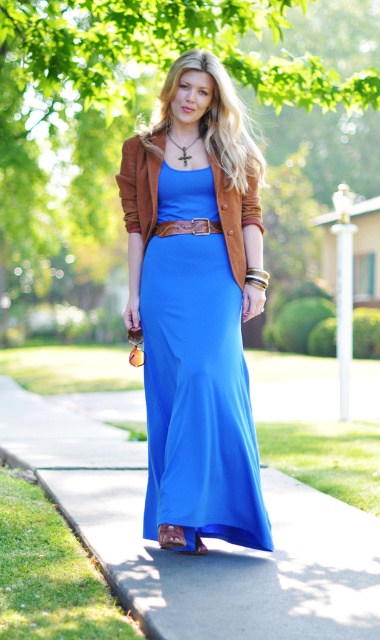
You are standing at the edge of the pathway and want to place a small potted plant exactly where the smooth concrete pavement at lower center is located. What are the coordinates where you should place it?

The coordinates for placing the small potted plant on the smooth concrete pavement at lower center are at point (x=204, y=540).

You are designing a layout for a fashion magazine spread and need to place a text box near the satin blue dress at center. Given that the dress is positioned at coordinates 0.591 on the x and 0.518 on the y axis, where should you place the text box to ensure it doesn not overlap with the dress?

The satin blue dress at center is located at point (196, 378). To avoid overlapping, place the text box either to the left, right, above, or below these coordinates, ensuring sufficient spacing from the dress.